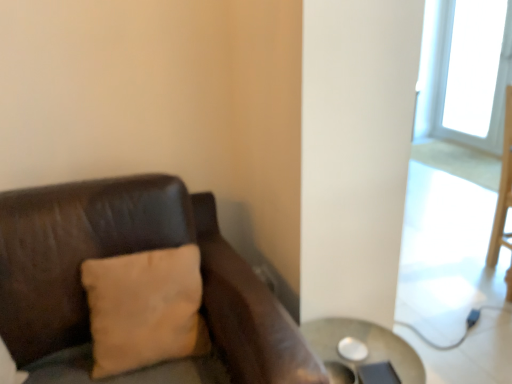
Question: In terms of size, does beige fabric pillow at left appear bigger or smaller than metallic silver table at lower right?

Choices:
 (A) big
 (B) small

Answer: (B)

Question: Is beige fabric pillow at left spatially inside metallic silver table at lower right, or outside of it?

Choices:
 (A) inside
 (B) outside

Answer: (B)

Question: In terms of height, does beige fabric pillow at left look taller or shorter compared to metallic silver table at lower right?

Choices:
 (A) tall
 (B) short

Answer: (A)

Question: Based on their positions, is metallic silver table at lower right located to the left or right of beige fabric pillow at left?

Choices:
 (A) right
 (B) left

Answer: (A)

Question: From their relative heights in the image, would you say metallic silver table at lower right is taller or shorter than beige fabric pillow at left?

Choices:
 (A) tall
 (B) short

Answer: (B)

Question: From a real-world perspective, is metallic silver table at lower right positioned above or below beige fabric pillow at left?

Choices:
 (A) above
 (B) below

Answer: (B)

Question: In the image, is metallic silver table at lower right positioned in front of or behind beige fabric pillow at left?

Choices:
 (A) front
 (B) behind

Answer: (B)